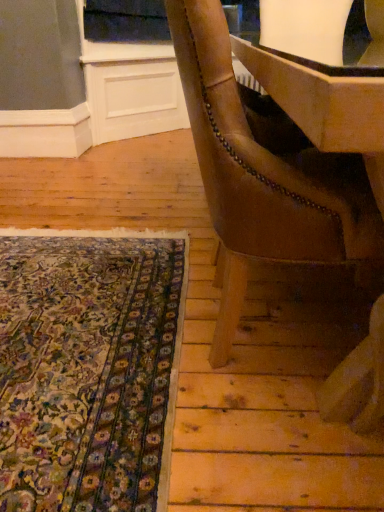
Image resolution: width=384 pixels, height=512 pixels. What are the coordinates of `leather at right` in the screenshot? It's located at (264, 174).

This screenshot has height=512, width=384. What do you see at coordinates (264, 174) in the screenshot?
I see `leather at right` at bounding box center [264, 174].

The width and height of the screenshot is (384, 512). I want to click on floral carpet at lower left, so click(88, 368).

The height and width of the screenshot is (512, 384). Describe the element at coordinates (88, 368) in the screenshot. I see `floral carpet at lower left` at that location.

Identify the location of leather at right. The width and height of the screenshot is (384, 512). (264, 174).

Looking at this image, considering the relative positions of leather at right and floral carpet at lower left in the image provided, is leather at right to the left of floral carpet at lower left from the viewer's perspective?

In fact, leather at right is to the right of floral carpet at lower left.

Who is more distant, leather at right or floral carpet at lower left?

floral carpet at lower left is more distant.

Between point (215, 170) and point (98, 405), which one is positioned in front?

The point (215, 170) is closer to the camera.

From the picture: From the image's perspective, does leather at right appear lower than floral carpet at lower left?

No, from the image's perspective, leather at right is not below floral carpet at lower left.

From a real-world perspective, does leather at right stand above floral carpet at lower left?

Yes, from a real-world perspective, leather at right is above floral carpet at lower left.

Is leather at right wider or thinner than floral carpet at lower left?

Considering their sizes, leather at right looks slimmer than floral carpet at lower left.

Which of these two, leather at right or floral carpet at lower left, stands shorter?

floral carpet at lower left.

Can you confirm if leather at right is smaller than floral carpet at lower left?

→ Incorrect, leather at right is not smaller in size than floral carpet at lower left.

Is leather at right not within floral carpet at lower left?

Yes, leather at right is located beyond the bounds of floral carpet at lower left.

Would you say leather at right is a long distance from floral carpet at lower left?

No, leather at right is in close proximity to floral carpet at lower left.

From the picture: Is leather at right facing away from floral carpet at lower left?

Yes, floral carpet at lower left is at the back of leather at right.

How many degrees apart are the facing directions of leather at right and floral carpet at lower left?

0.81 degrees separate the facing orientations of leather at right and floral carpet at lower left.

How much distance is there between leather at right and floral carpet at lower left?

The distance of leather at right from floral carpet at lower left is 47.19 centimeters.

Find the location of a particular element. This screenshot has height=512, width=384. mat behind the leather at right is located at coordinates (88, 368).

In the image, is floral carpet at lower left on the left side or the right side of leather at right?

Clearly, floral carpet at lower left is on the left of leather at right in the image.

In the image, is floral carpet at lower left positioned in front of or behind leather at right?

In the image, floral carpet at lower left appears behind leather at right.

Is point (40, 444) farther from viewer compared to point (246, 283)?

That is False.

From the image's perspective, which is above, floral carpet at lower left or leather at right?

leather at right is shown above in the image.

From a real-world perspective, is floral carpet at lower left on leather at right?

No, from a real-world perspective, floral carpet at lower left is not on top of leather at right.

From the picture: Between floral carpet at lower left and leather at right, which one has smaller width?

Thinner between the two is leather at right.

Considering the sizes of objects floral carpet at lower left and leather at right in the image provided, who is shorter, floral carpet at lower left or leather at right?

With less height is floral carpet at lower left.

Does floral carpet at lower left have a smaller size compared to leather at right?

Yes.

Is leather at right a part of floral carpet at lower left?

No.

Is floral carpet at lower left with leather at right?

No, floral carpet at lower left is not beside leather at right.

Is floral carpet at lower left facing away from leather at right?

No.

How many degrees apart are the facing directions of floral carpet at lower left and leather at right?

0.81 degrees separate the facing orientations of floral carpet at lower left and leather at right.

Measure the distance from floral carpet at lower left to leather at right.

floral carpet at lower left and leather at right are 47.19 centimeters apart.

Locate an element on the screen. The image size is (384, 512). chair lying above the floral carpet at lower left (from the image's perspective) is located at coordinates (264, 174).

Find the location of a particular element. mat behind the leather at right is located at coordinates (88, 368).

Find the location of a particular element. Image resolution: width=384 pixels, height=512 pixels. mat below the leather at right (from the image's perspective) is located at coordinates (88, 368).